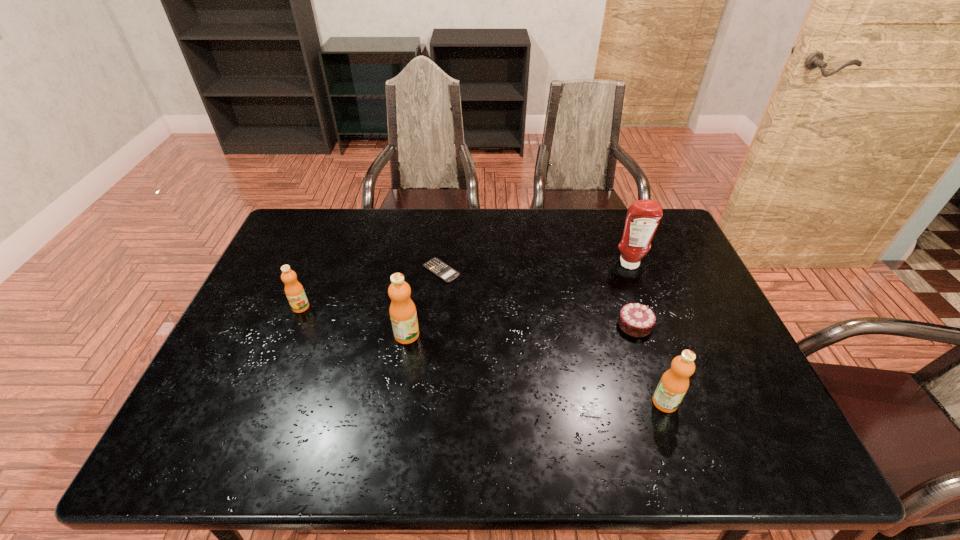
Where is `free spot at the right edge of the desktop`? The width and height of the screenshot is (960, 540). free spot at the right edge of the desktop is located at coordinates (673, 277).

The width and height of the screenshot is (960, 540). In the image, there is a desktop. What are the coordinates of `free space at the far left corner` in the screenshot? It's located at (324, 221).

Where is `vacant space that's between the second farthest orange juice and the condiment`? The width and height of the screenshot is (960, 540). vacant space that's between the second farthest orange juice and the condiment is located at coordinates (518, 300).

Where is `vacant area between the rightmost orange juice and the third shortest object`? vacant area between the rightmost orange juice and the third shortest object is located at coordinates (483, 355).

This screenshot has height=540, width=960. What are the coordinates of `vacant space that is in between the second orange juice from right to left and the condiment` in the screenshot? It's located at pos(518,300).

The image size is (960, 540). I want to click on free spot between the chocolate cake and the shortest object, so [x=538, y=298].

Identify the location of free spot between the fifth tallest object and the second tallest orange juice. (650, 363).

Locate an element on the screen. Image resolution: width=960 pixels, height=540 pixels. free space between the second orange juice from right to left and the second tallest orange juice is located at coordinates 536,369.

Identify the location of free space between the second shortest object and the leftmost object. This screenshot has height=540, width=960. (468, 316).

Select which object appears as the closest to the fourth shortest object. Please provide its 2D coordinates. Your answer should be formatted as a tuple, i.e. [(x, y)], where the tuple contains the x and y coordinates of a point satisfying the conditions above.

[(637, 320)]